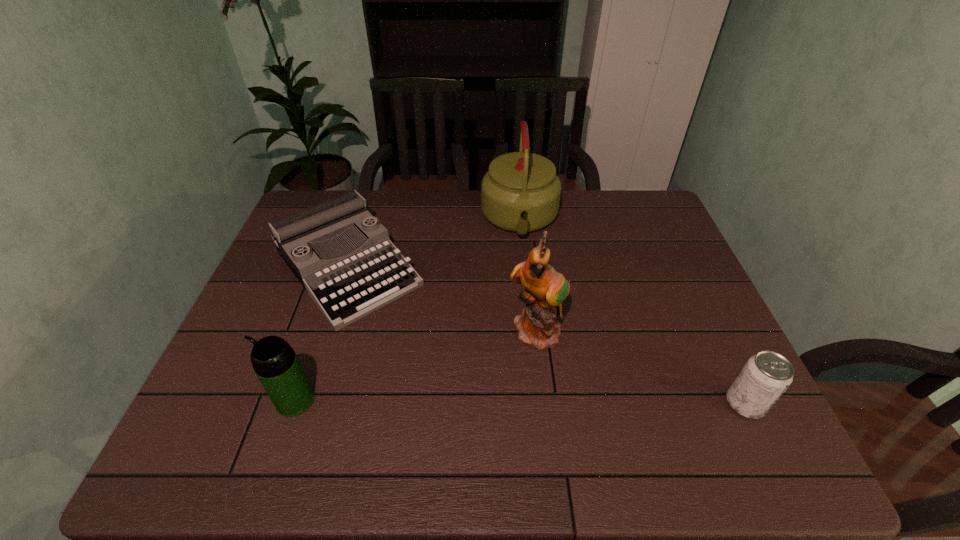
At what (x,y) coordinates should I click in order to perform the action: click on vacant space on the desktop that is between the third shortest object and the rightmost object and is positioned on the typing side of the typewriter. Please return your answer as a coordinate pair (x, y). The height and width of the screenshot is (540, 960). Looking at the image, I should click on (465, 401).

Identify the location of free space on the desktop that is between the thermos bottle and the rightmost object and is positioned at the spout of the kettle. (532, 402).

Identify the location of vacant space on the desktop that is between the thermos bottle and the soda can and is positioned on the front-facing side of the parrot. (570, 402).